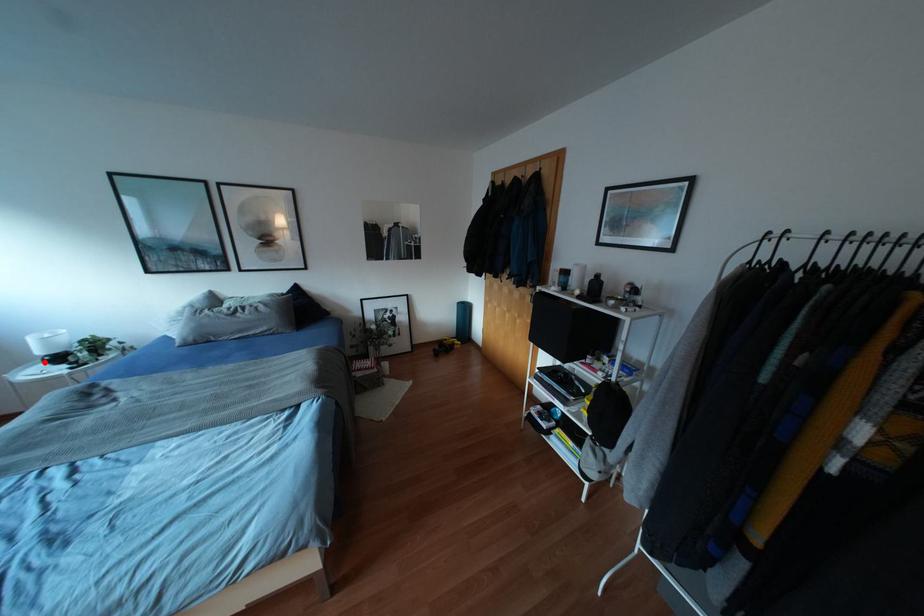
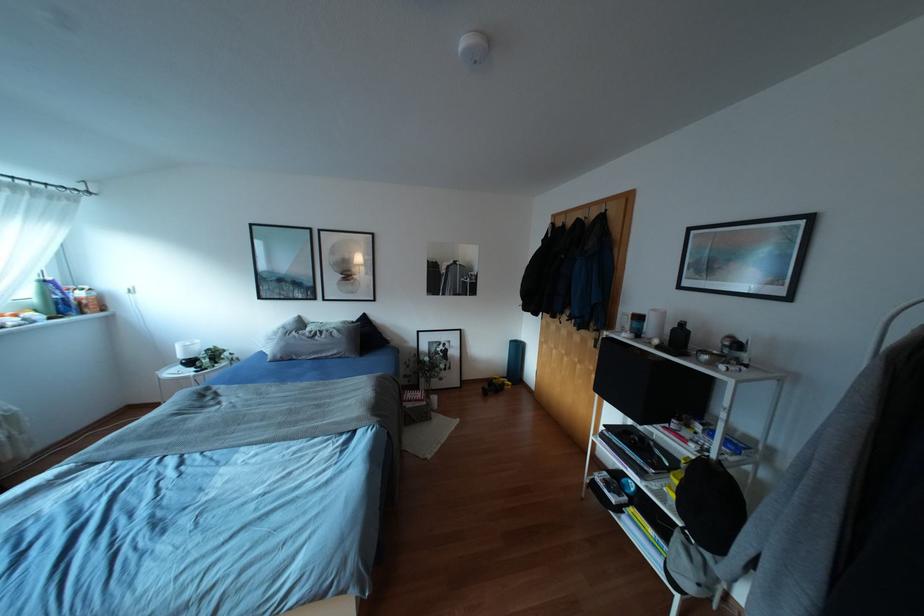
The point at the highlighted location is marked in the first image. Where is the corresponding point in the second image?

(180, 363)